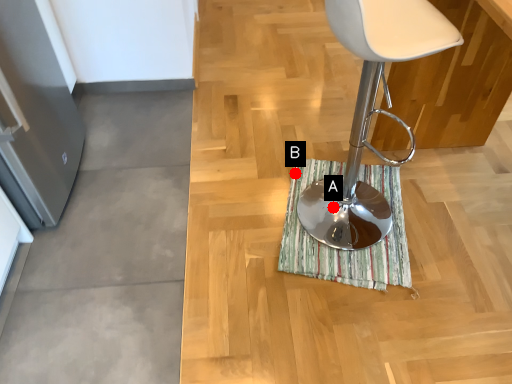
Question: Two points are circled on the image, labeled by A and B beside each circle. Which point is closer to the camera taking this photo?

Choices:
 (A) A is closer
 (B) B is closer

Answer: (A)